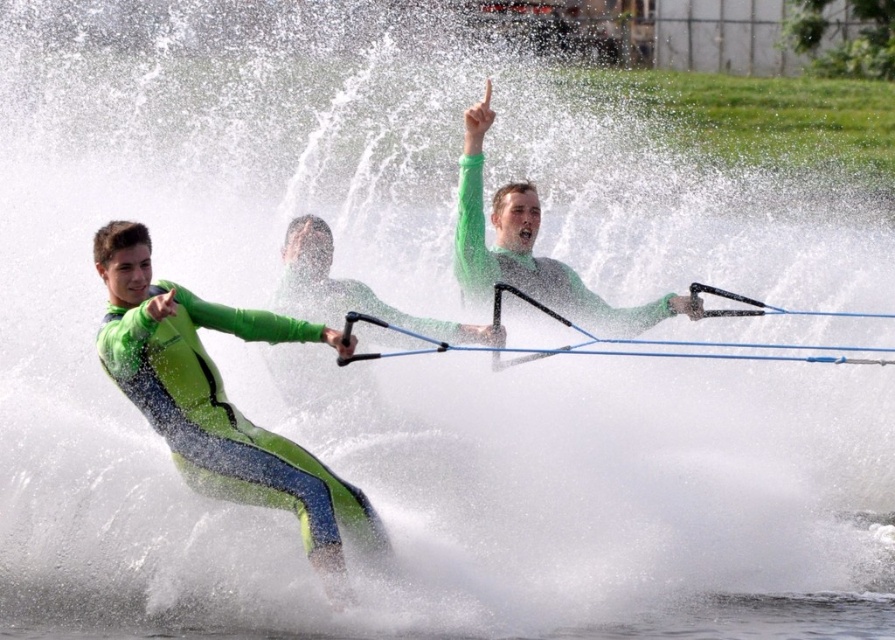
Question: Can you confirm if green neoprene wetsuit at left is positioned below green matte wetsuit at center?

Choices:
 (A) no
 (B) yes

Answer: (B)

Question: From the image, what is the correct spatial relationship of green neoprene wetsuit at left in relation to green matte wetsuit at center?

Choices:
 (A) below
 (B) above

Answer: (A)

Question: Does green neoprene wetsuit at left have a greater width compared to green matte wetsuit at center?

Choices:
 (A) no
 (B) yes

Answer: (A)

Question: Which point appears farthest from the camera in this image?

Choices:
 (A) (x=338, y=593)
 (B) (x=587, y=317)

Answer: (B)